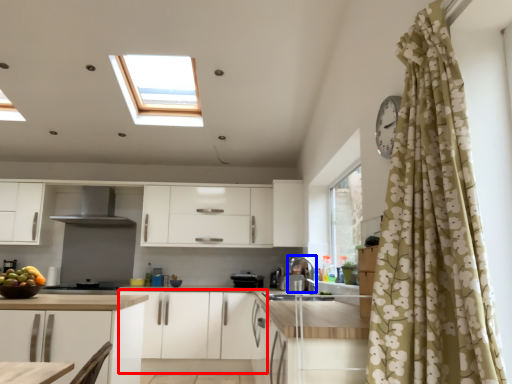
Question: Among these objects, which one is nearest to the camera, cabinetry (highlighted by a red box) or appliance (highlighted by a blue box)?

Choices:
 (A) cabinetry
 (B) appliance

Answer: (B)